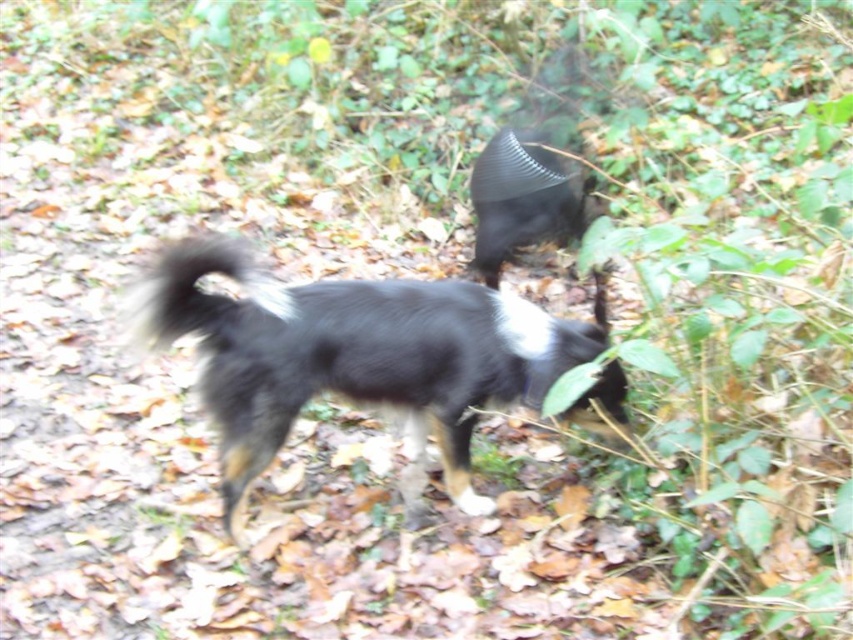
Between black fuzzy dog at center and fluffy black tail at center, which one appears on the left side from the viewer's perspective?

Positioned to the left is fluffy black tail at center.

Based on the photo, who is more forward, (608,385) or (260,282)?

Point (260,282) is more forward.

Does point (173, 321) come farther from viewer compared to point (258, 323)?

No, it is in front of (258, 323).

Where is `black fuzzy dog at center`? The width and height of the screenshot is (853, 640). black fuzzy dog at center is located at coordinates (357, 356).